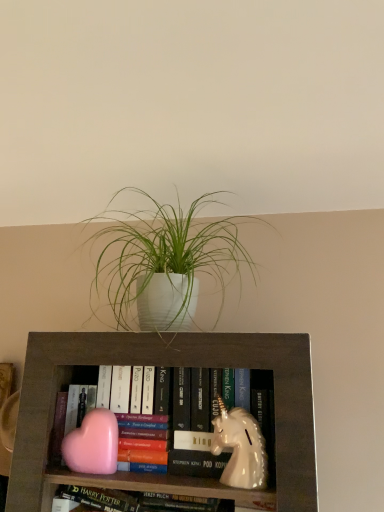
Identify the location of white matte plant pot at upper center. Image resolution: width=384 pixels, height=512 pixels. (165, 260).

What is the approximate width of pink matte heart at lower left, the first animal positioned from the left?

pink matte heart at lower left, the first animal positioned from the left, is 2.77 inches wide.

Find the location of a particular element. white matte plant pot at upper center is located at coordinates (165, 260).

Where is `animal on the left of white matte plant pot at upper center`? This screenshot has width=384, height=512. animal on the left of white matte plant pot at upper center is located at coordinates (93, 444).

Is white matte plant pot at upper center positioned beyond the bounds of pink matte heart at lower left, the first animal positioned from the left?

white matte plant pot at upper center is positioned outside pink matte heart at lower left, the first animal positioned from the left.

Can you tell me how much white matte plant pot at upper center and pink matte heart at lower left, the first animal positioned from the left, differ in facing direction?

3.62 degrees separate the facing orientations of white matte plant pot at upper center and pink matte heart at lower left, the first animal positioned from the left.

From a real-world perspective, is white matte plant pot at upper center located beneath pink matte heart at lower left, the first animal positioned from the left?

Actually, white matte plant pot at upper center is physically above pink matte heart at lower left, the first animal positioned from the left, in the real world.

Based on the photo, does pink matte heart at lower left, the second animal in the right-to-left sequence, have a larger size compared to white matte plant pot at upper center?

No.

From the picture: From the image's perspective, is pink matte heart at lower left, the first animal positioned from the left, beneath white matte plant pot at upper center?

Yes, from the image's perspective, pink matte heart at lower left, the first animal positioned from the left, is below white matte plant pot at upper center.

From a real-world perspective, is pink matte heart at lower left, the second animal in the right-to-left sequence, under white matte plant pot at upper center?

Yes.

Which of these two, pink matte heart at lower left, the second animal in the right-to-left sequence, or white matte plant pot at upper center, stands shorter?

With less height is pink matte heart at lower left, the second animal in the right-to-left sequence.

Can you tell me how much white glossy unicorn at center, which is counted as the second animal, starting from the left, and white matte plant pot at upper center differ in facing direction?

There is a 3.62-degree angle between the facing directions of white glossy unicorn at center, which is counted as the second animal, starting from the left, and white matte plant pot at upper center.

From a real-world perspective, is white glossy unicorn at center, which is counted as the second animal, starting from the left, physically below white matte plant pot at upper center?

Yes.

Is there a large distance between white glossy unicorn at center, the 1th animal viewed from the right, and white matte plant pot at upper center?

No.

Is pink matte heart at lower left, the first animal positioned from the left, placed right next to white glossy unicorn at center, which is counted as the second animal, starting from the left?

They are not placed beside each other.

From the image's perspective, is pink matte heart at lower left, the first animal positioned from the left, above or below white glossy unicorn at center, the 1th animal viewed from the right?

Clearly, from the image's perspective, pink matte heart at lower left, the first animal positioned from the left, is below white glossy unicorn at center, the 1th animal viewed from the right.

Which point is more forward, (77, 448) or (243, 429)?

Positioned in front is point (243, 429).

Is pink matte heart at lower left, the first animal positioned from the left, at the right side of white glossy unicorn at center, which is counted as the second animal, starting from the left?

No.

What's the angular difference between white glossy unicorn at center, the 1th animal viewed from the right, and pink matte heart at lower left, the first animal positioned from the left,'s facing directions?

The angle between the facing direction of white glossy unicorn at center, the 1th animal viewed from the right, and the facing direction of pink matte heart at lower left, the first animal positioned from the left, is 0.000398 degrees.

Is white glossy unicorn at center, which is counted as the second animal, starting from the left, outside of pink matte heart at lower left, the first animal positioned from the left?

white glossy unicorn at center, which is counted as the second animal, starting from the left, lies outside pink matte heart at lower left, the first animal positioned from the left,'s area.

Does white glossy unicorn at center, which is counted as the second animal, starting from the left, lie behind pink matte heart at lower left, the first animal positioned from the left?

No, white glossy unicorn at center, which is counted as the second animal, starting from the left, is closer to the camera.

Where is `animal that appears below the white glossy unicorn at center, the 1th animal viewed from the right (from a real-world perspective)`? animal that appears below the white glossy unicorn at center, the 1th animal viewed from the right (from a real-world perspective) is located at coordinates (93, 444).

Considering the relative positions of white matte plant pot at upper center and white glossy unicorn at center, which is counted as the second animal, starting from the left, in the image provided, is white matte plant pot at upper center behind white glossy unicorn at center, which is counted as the second animal, starting from the left,?

That is False.

Could you tell me if white matte plant pot at upper center is turned towards white glossy unicorn at center, which is counted as the second animal, starting from the left?

No, white matte plant pot at upper center does not turn towards white glossy unicorn at center, which is counted as the second animal, starting from the left.

Considering the relative sizes of white matte plant pot at upper center and white glossy unicorn at center, which is counted as the second animal, starting from the left, in the image provided, is white matte plant pot at upper center bigger than white glossy unicorn at center, which is counted as the second animal, starting from the left,?

Yes, white matte plant pot at upper center is bigger than white glossy unicorn at center, which is counted as the second animal, starting from the left.

At what (x,y) coordinates should I click in order to perform the action: click on houseplant above the pink matte heart at lower left, the first animal positioned from the left (from a real-world perspective). Please return your answer as a coordinate pair (x, y). The image size is (384, 512). Looking at the image, I should click on (165, 260).

Locate an element on the screen. This screenshot has height=512, width=384. animal that is the 2nd one when counting downward from the white matte plant pot at upper center (from the image's perspective) is located at coordinates (93, 444).

Which object lies nearer to the anchor point pink matte heart at lower left, the second animal in the right-to-left sequence, white glossy unicorn at center, which is counted as the second animal, starting from the left, or white matte plant pot at upper center?

white glossy unicorn at center, which is counted as the second animal, starting from the left, is closer to pink matte heart at lower left, the second animal in the right-to-left sequence.

From the image, which object appears to be nearer to white matte plant pot at upper center, white glossy unicorn at center, which is counted as the second animal, starting from the left, or pink matte heart at lower left, the first animal positioned from the left?

white glossy unicorn at center, which is counted as the second animal, starting from the left, is positioned closer to the anchor white matte plant pot at upper center.

Estimate the real-world distances between objects in this image. Which object is closer to white matte plant pot at upper center, pink matte heart at lower left, the first animal positioned from the left, or white glossy unicorn at center, the 1th animal viewed from the right?

white glossy unicorn at center, the 1th animal viewed from the right, is closer to white matte plant pot at upper center.

From the image, which object appears to be nearer to white glossy unicorn at center, which is counted as the second animal, starting from the left, pink matte heart at lower left, the first animal positioned from the left, or white matte plant pot at upper center?

pink matte heart at lower left, the first animal positioned from the left, is positioned closer to the anchor white glossy unicorn at center, which is counted as the second animal, starting from the left.

From the image, which object appears to be farther from white glossy unicorn at center, which is counted as the second animal, starting from the left, white matte plant pot at upper center or pink matte heart at lower left, the second animal in the right-to-left sequence?

Based on the image, white matte plant pot at upper center appears to be further to white glossy unicorn at center, which is counted as the second animal, starting from the left.

From the image, which object appears to be nearer to pink matte heart at lower left, the second animal in the right-to-left sequence, white matte plant pot at upper center or white glossy unicorn at center, the 1th animal viewed from the right?

Based on the image, white glossy unicorn at center, the 1th animal viewed from the right, appears to be nearer to pink matte heart at lower left, the second animal in the right-to-left sequence.

I want to click on animal that lies between white matte plant pot at upper center and pink matte heart at lower left, the second animal in the right-to-left sequence, from top to bottom, so click(x=240, y=448).